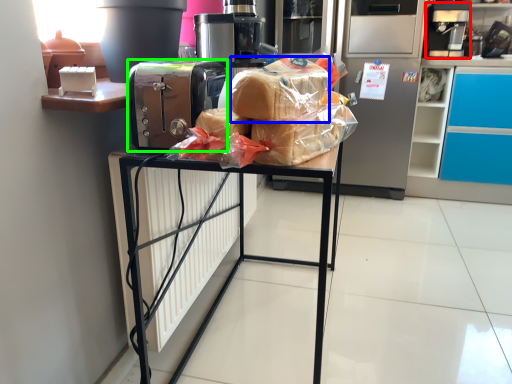
Question: Considering the real-world distances, which object is closest to coffee machine (highlighted by a red box)? bread (highlighted by a blue box) or home appliance (highlighted by a green box).

Choices:
 (A) bread
 (B) home appliance

Answer: (A)